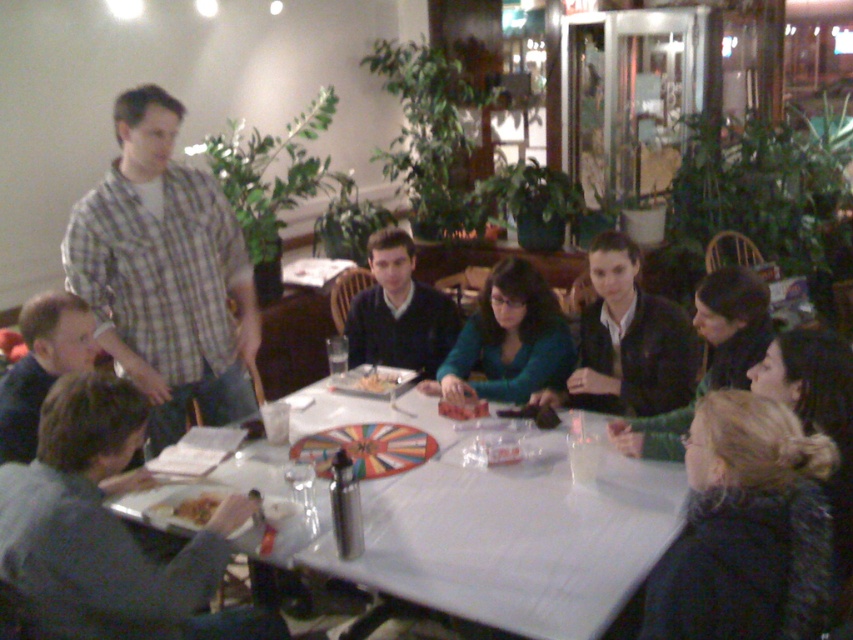
Question: Can you confirm if brown crumbly bread at lower left is positioned to the left of smooth plastic fork at center?

Choices:
 (A) no
 (B) yes

Answer: (B)

Question: Which of the following is the farthest from the observer?

Choices:
 (A) (448, 348)
 (B) (212, 404)
 (C) (393, 378)
 (D) (503, 360)

Answer: (A)

Question: Which is farther from the white plastic table at center?

Choices:
 (A) matte green sweater at center
 (B) smooth plastic spinner at center
 (C) brown crumbly bread at lower left

Answer: (B)

Question: Which object is the closest to the brown crumbly bread at lower left?

Choices:
 (A) black matte jacket at center
 (B) matte green sweater at center
 (C) plaid shirt at left
 (D) dark blue sweater at center

Answer: (C)

Question: Does matte green sweater at center lie behind brown crumbly bread at lower left?

Choices:
 (A) no
 (B) yes

Answer: (B)

Question: Observing the image, what is the correct spatial positioning of dark blue sweater at center in reference to smooth plastic spinner at center?

Choices:
 (A) above
 (B) below

Answer: (A)